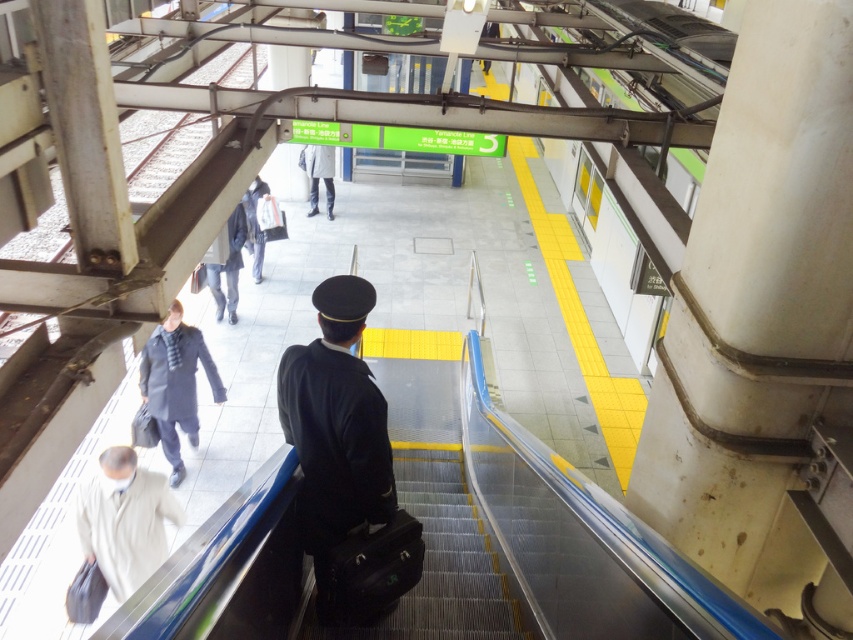
Who is lower down, dark blue uniform at center or matte gray coat at lower left?

dark blue uniform at center is below.

Who is shorter, dark blue uniform at center or matte gray coat at lower left?

With less height is dark blue uniform at center.

Is point (305, 508) farther from camera compared to point (161, 381)?

No, (305, 508) is closer to viewer.

Where is `dark blue uniform at center`? dark blue uniform at center is located at coordinates (339, 449).

Between point (85, 545) and point (241, 241), which one is positioned in front?

Point (85, 545) is in front.

Is point (91, 554) closer to viewer compared to point (244, 228)?

Yes, point (91, 554) is in front of point (244, 228).

Is point (149, 506) in front of point (231, 228)?

Yes, it is in front of point (231, 228).

At what (x,y) coordinates should I click in order to perform the action: click on light beige fabric coat at lower left. Please return your answer as a coordinate pair (x, y). The height and width of the screenshot is (640, 853). Looking at the image, I should click on (125, 518).

Which is in front, point (500, 620) or point (260, 236)?

Point (500, 620) is in front.

Who is taller, black fabric suitcase at center or dark gray uniform at center?

With more height is dark gray uniform at center.

Is point (418, 598) positioned in front of point (265, 188)?

Yes, point (418, 598) is in front of point (265, 188).

Locate an element on the screen. The image size is (853, 640). black fabric suitcase at center is located at coordinates (440, 561).